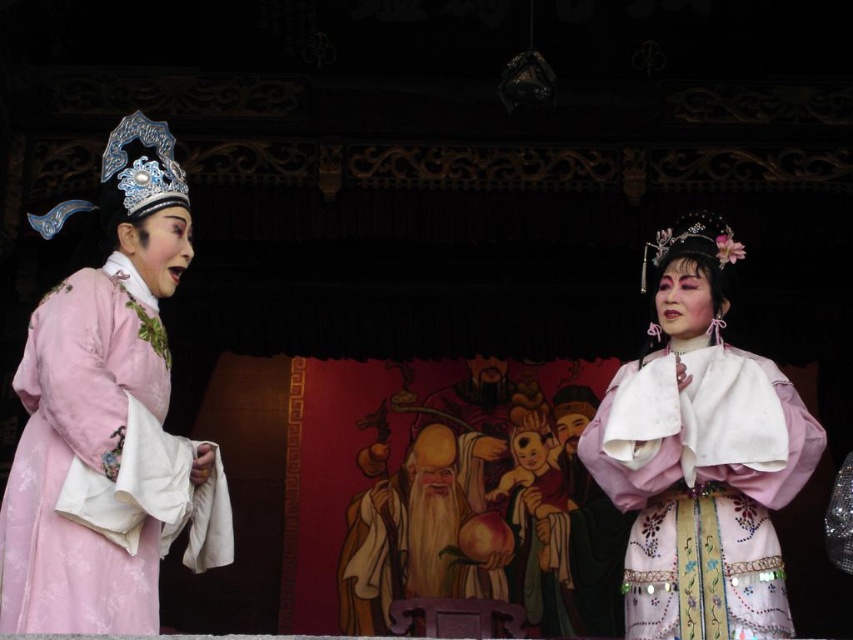
You are a stagehand in the theater and need to move a 1.2 meter wide curtain rod from the matte pink robe at left to the matte pink silk robe at center. Can you safely move it without bending the rod?

The distance between the matte pink robe at left and the matte pink silk robe at center is 15.80 meters. Since the curtain rod is only 1.2 meters wide, it can be moved safely without bending as the distance is sufficient.

You are a costume designer observing the traditional Chinese opera performance. You notice two performers wearing the matte pink robe at left and the matte pink silk robe at center. Which performer has a larger costume in terms of the area it covers?

The matte pink silk robe at center occupies more space than the matte pink robe at left, so the performer wearing the matte pink silk robe at center has a larger costume in terms of the area it covers.